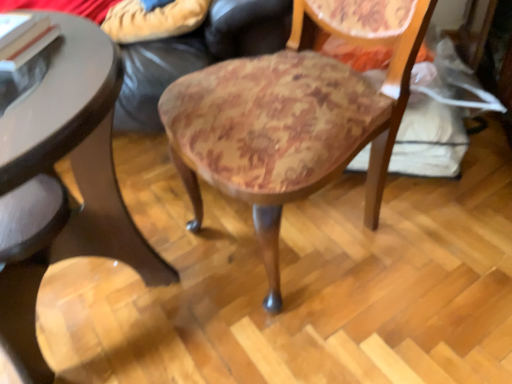
Question: Could you tell me if wooden round table at lower left is turned towards wooden upholstered chair at center?

Choices:
 (A) no
 (B) yes

Answer: (A)

Question: From the image's perspective, does wooden round table at lower left appear lower than wooden upholstered chair at center?

Choices:
 (A) no
 (B) yes

Answer: (B)

Question: From a real-world perspective, is wooden round table at lower left physically above wooden upholstered chair at center?

Choices:
 (A) yes
 (B) no

Answer: (B)

Question: Is wooden round table at lower left positioned before wooden upholstered chair at center?

Choices:
 (A) yes
 (B) no

Answer: (A)

Question: Can you confirm if wooden round table at lower left is smaller than wooden upholstered chair at center?

Choices:
 (A) no
 (B) yes

Answer: (A)

Question: From the image's perspective, relative to wooden round table at lower left, is wooden upholstered chair at center above or below?

Choices:
 (A) below
 (B) above

Answer: (B)

Question: Considering the positions of point (317, 8) and point (31, 69), is point (317, 8) closer or farther from the camera than point (31, 69)?

Choices:
 (A) closer
 (B) farther

Answer: (B)

Question: Is wooden upholstered chair at center spatially inside wooden round table at lower left, or outside of it?

Choices:
 (A) outside
 (B) inside

Answer: (A)

Question: Based on their positions, is wooden upholstered chair at center located to the left or right of wooden round table at lower left?

Choices:
 (A) left
 (B) right

Answer: (B)

Question: Relative to wooden round table at lower left, is leather couch at center in front or behind?

Choices:
 (A) behind
 (B) front

Answer: (A)

Question: Considering the positions of leather couch at center and wooden round table at lower left in the image, is leather couch at center wider or thinner than wooden round table at lower left?

Choices:
 (A) thin
 (B) wide

Answer: (B)

Question: From the image's perspective, is leather couch at center located above or below wooden round table at lower left?

Choices:
 (A) above
 (B) below

Answer: (A)

Question: Do you think leather couch at center is within wooden round table at lower left, or outside of it?

Choices:
 (A) inside
 (B) outside

Answer: (B)

Question: From a real-world perspective, is wooden round table at lower left physically located above or below leather couch at center?

Choices:
 (A) below
 (B) above

Answer: (B)

Question: From the image's perspective, is wooden round table at lower left located above or below leather couch at center?

Choices:
 (A) above
 (B) below

Answer: (B)